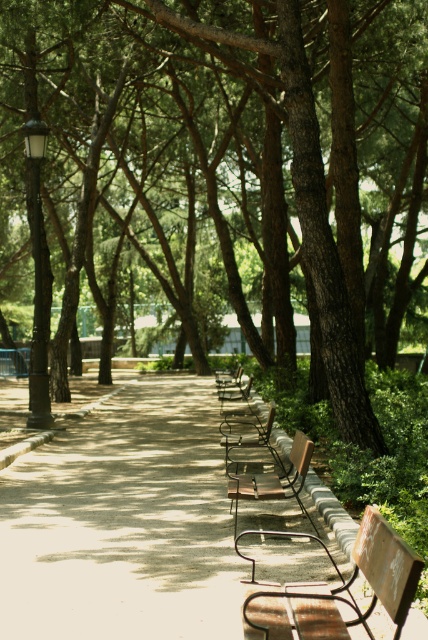
Consider the image. You are planning to place a small potted plant between the brown wooden chair at center and the metallic silver chair at center along the park pathway. Which chair should the plant be closer to if you want it to be closer to the narrower chair?

The brown wooden chair at center has a smaller width than the metallic silver chair at center, so the plant should be placed closer to the brown wooden chair at center to be nearer to the narrower one.

You are a visitor in the park and want to sit on the brown metal chair at center. There is a brown textured tree at center nearby. Which direction should you walk to reach the chair without passing through the tree?

Since the brown textured tree at center is positioned on the right side of the brown metal chair at center, you should walk to the left side of the tree to reach the chair without passing through it.

You are sitting on the metallic silver chair at center in the park and want to move to the brown wooden chair at center. In which direction should you move relative to the chair you are currently on?

You should move to the left relative to your current position on the metallic silver chair at center because the brown wooden chair at center is positioned to the left of it.